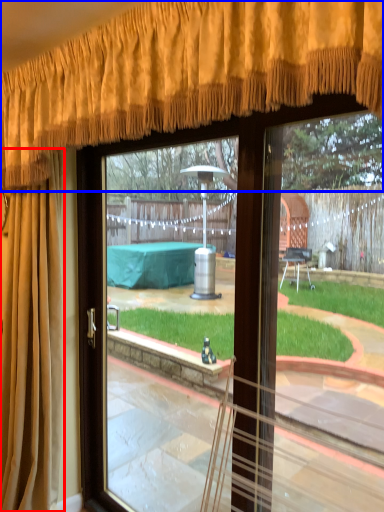
Question: Among these objects, which one is nearest to the camera, curtain (highlighted by a red box) or curtain (highlighted by a blue box)?

Choices:
 (A) curtain
 (B) curtain

Answer: (B)